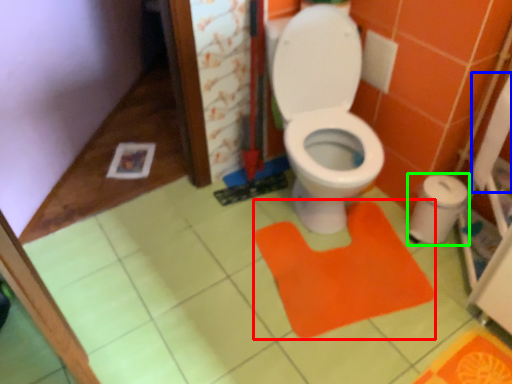
Question: Based on their relative distances, which object is nearer to doormat (highlighted by a red box)? Choose from toilet paper (highlighted by a blue box) and potty (highlighted by a green box).

Choices:
 (A) toilet paper
 (B) potty

Answer: (B)